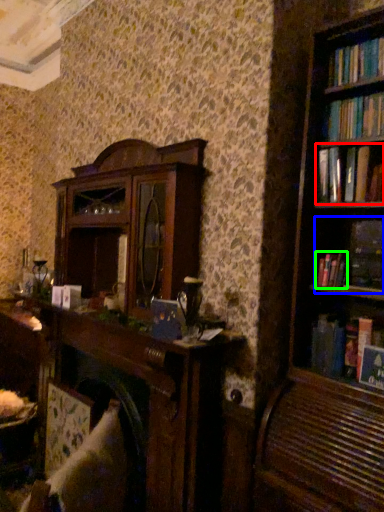
Question: Which is nearer to the book (highlighted by a red box)? book (highlighted by a blue box) or book (highlighted by a green box).

Choices:
 (A) book
 (B) book

Answer: (A)